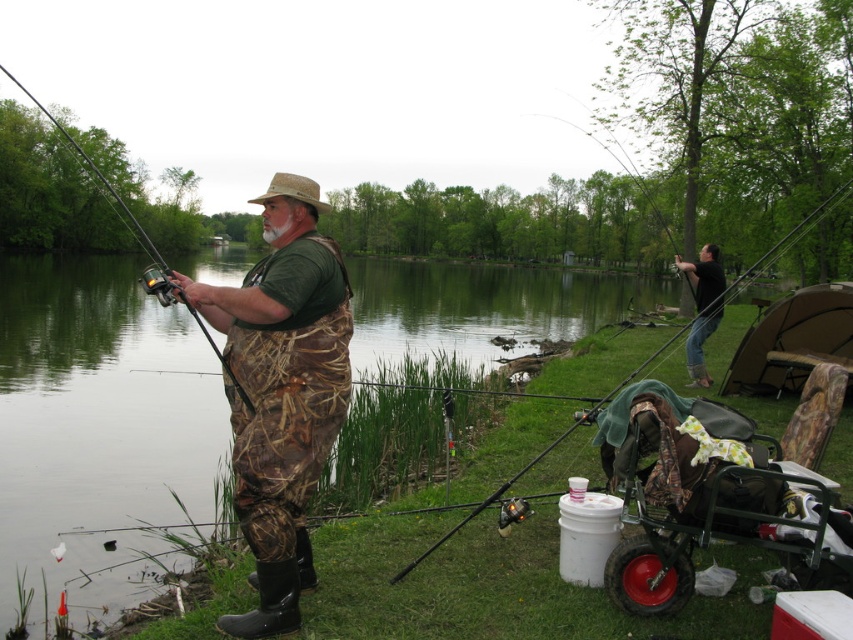
Is dark green shirt at right above matte black fishing pole at left?

Actually, dark green shirt at right is below matte black fishing pole at left.

Consider the image. Is dark green shirt at right bigger than matte black fishing pole at left?

No, dark green shirt at right is not bigger than matte black fishing pole at left.

Between point (701, 323) and point (144, 243), which one is positioned behind?

Point (144, 243)

This screenshot has width=853, height=640. Find the location of `dark green shirt at right`. dark green shirt at right is located at coordinates (701, 308).

You are a GUI agent. You are given a task and a screenshot of the screen. Output one action in this format:
    pyautogui.click(x=<x>, y=<y>)
    Task: Click on the camo fabric waders at center
    Image resolution: width=853 pixels, height=640 pixels.
    Given the screenshot: What is the action you would take?
    (281, 392)

I want to click on camo fabric waders at center, so 281,392.

This screenshot has height=640, width=853. What are the coordinates of `camo fabric waders at center` in the screenshot? It's located at (281, 392).

Who is lower down, camo fabric waders at center or matte black fishing pole at left?

camo fabric waders at center is below.

Who is shorter, camo fabric waders at center or matte black fishing pole at left?

camo fabric waders at center

Between point (271, 253) and point (3, 68), which one is positioned in front?

Positioned in front is point (271, 253).

Where is `camo fabric waders at center`? The image size is (853, 640). camo fabric waders at center is located at coordinates (281, 392).